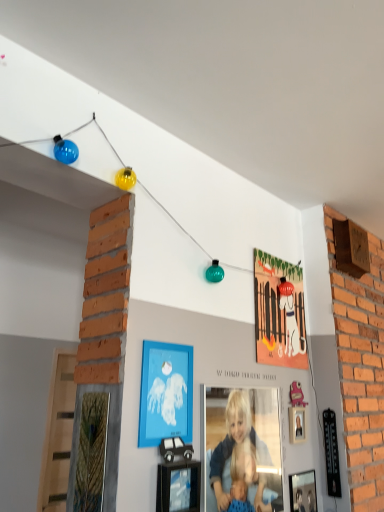
Question: In which direction should I rotate to look at black cardboard car at lower center, arranged as the 3th picture frame when viewed from the top?

Choices:
 (A) right
 (B) left

Answer: (B)

Question: Is black cardboard car at lower center, positioned as the 1th picture frame in front-to-back order, outside of blue matte picture frame at center, the 3th picture frame from the back?

Choices:
 (A) yes
 (B) no

Answer: (A)

Question: From the image's perspective, would you say black cardboard car at lower center, the second picture frame positioned from the bottom, is shown under blue matte picture frame at center, the 2th picture frame viewed from the top?

Choices:
 (A) yes
 (B) no

Answer: (A)

Question: Can you confirm if black cardboard car at lower center, the third picture frame when ordered from right to left, is smaller than blue matte picture frame at center, which appears as the third picture frame when ordered from the bottom?

Choices:
 (A) no
 (B) yes

Answer: (A)

Question: Is black cardboard car at lower center, the second picture frame positioned from the bottom, taller than blue matte picture frame at center, the 2th picture frame viewed from the top?

Choices:
 (A) no
 (B) yes

Answer: (A)

Question: Considering the relative sizes of black cardboard car at lower center, the second picture frame positioned from the bottom, and blue matte picture frame at center, the 2th picture frame viewed from the top, in the image provided, is black cardboard car at lower center, the second picture frame positioned from the bottom, bigger than blue matte picture frame at center, the 2th picture frame viewed from the top,?

Choices:
 (A) no
 (B) yes

Answer: (B)

Question: From a real-world perspective, is black cardboard car at lower center, the third picture frame when ordered from right to left, positioned over blue matte picture frame at center, which is the 2th picture frame from front to back, based on gravity?

Choices:
 (A) yes
 (B) no

Answer: (B)

Question: Is matte orange picture frame at upper center, which appears as the fourth picture frame when ordered from the bottom, not inside smooth blonde hair at center?

Choices:
 (A) no
 (B) yes

Answer: (B)

Question: Is matte orange picture frame at upper center, which is counted as the first picture frame, starting from the top, bigger than smooth blonde hair at center?

Choices:
 (A) no
 (B) yes

Answer: (A)

Question: Considering the relative sizes of matte orange picture frame at upper center, which is counted as the first picture frame, starting from the top, and smooth blonde hair at center in the image provided, is matte orange picture frame at upper center, which is counted as the first picture frame, starting from the top, taller than smooth blonde hair at center?

Choices:
 (A) no
 (B) yes

Answer: (B)

Question: From a real-world perspective, is matte orange picture frame at upper center, which is counted as the first picture frame, starting from the top, on smooth blonde hair at center?

Choices:
 (A) no
 (B) yes

Answer: (B)

Question: From the image's perspective, is matte orange picture frame at upper center, marked as the fourth picture frame in a front-to-back arrangement, below smooth blonde hair at center?

Choices:
 (A) yes
 (B) no

Answer: (B)

Question: Is matte orange picture frame at upper center, arranged as the 2th picture frame when viewed from the right, closer to camera compared to smooth blonde hair at center?

Choices:
 (A) yes
 (B) no

Answer: (B)

Question: Is blue matte picture frame at center, the 3th picture frame from the back, further to camera compared to matte orange picture frame at upper center, the third picture frame from the left?

Choices:
 (A) no
 (B) yes

Answer: (A)